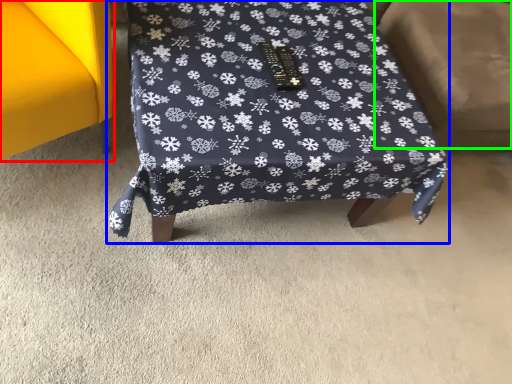
Question: Estimate the real-world distances between objects in this image. Which object is closer to furniture (highlighted by a red box), furniture (highlighted by a blue box) or swivel chair (highlighted by a green box)?

Choices:
 (A) furniture
 (B) swivel chair

Answer: (A)